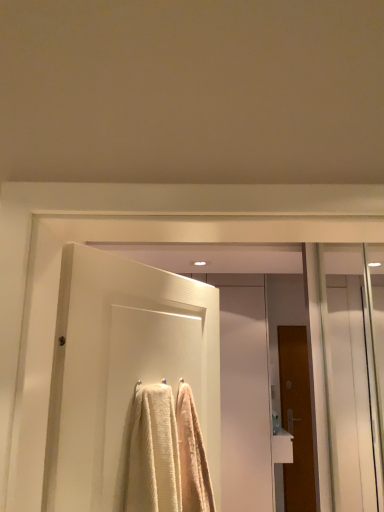
Question: Is brown wooden door at right, which is counted as the 1th door, starting from the bottom, positioned beyond the bounds of white glossy door at center, marked as the second screen door in a front-to-back arrangement?

Choices:
 (A) no
 (B) yes

Answer: (B)

Question: Considering the relative sizes of brown wooden door at right, the second door positioned from the top, and white glossy door at center, marked as the second screen door in a front-to-back arrangement, in the image provided, is brown wooden door at right, the second door positioned from the top, wider than white glossy door at center, marked as the second screen door in a front-to-back arrangement,?

Choices:
 (A) no
 (B) yes

Answer: (B)

Question: Considering the relative sizes of brown wooden door at right, which appears as the second door when viewed from the front, and white glossy door at center, the second screen door in the right-to-left sequence, in the image provided, is brown wooden door at right, which appears as the second door when viewed from the front, taller than white glossy door at center, the second screen door in the right-to-left sequence,?

Choices:
 (A) yes
 (B) no

Answer: (B)

Question: From the image's perspective, is brown wooden door at right, which appears as the second door when viewed from the front, located beneath white glossy door at center, which is the 1th screen door from back to front?

Choices:
 (A) yes
 (B) no

Answer: (A)

Question: Does brown wooden door at right, the second door positioned from the top, contain white glossy door at center, which is the first screen door from left to right?

Choices:
 (A) yes
 (B) no

Answer: (B)

Question: In terms of height, does transparent glass screen door at right, placed as the 1th screen door when sorted from right to left, look taller or shorter compared to white glossy sink at lower right?

Choices:
 (A) tall
 (B) short

Answer: (A)

Question: Relative to white glossy sink at lower right, is transparent glass screen door at right, which is the second screen door from back to front, in front or behind?

Choices:
 (A) front
 (B) behind

Answer: (A)

Question: Looking at the image, does transparent glass screen door at right, which is the second screen door from back to front, seem bigger or smaller compared to white glossy sink at lower right?

Choices:
 (A) big
 (B) small

Answer: (A)

Question: From the image's perspective, is transparent glass screen door at right, marked as the 2th screen door in a left-to-right arrangement, above or below white glossy sink at lower right?

Choices:
 (A) below
 (B) above

Answer: (B)

Question: From the image's perspective, relative to white textured door at center, which is the 1th door in left-to-right order, is brown wooden door at right, which is the 1th door from right to left, above or below?

Choices:
 (A) above
 (B) below

Answer: (B)

Question: Considering the relative positions of brown wooden door at right, which is counted as the 1th door, starting from the bottom, and white textured door at center, the 1th door when ordered from top to bottom, in the image provided, is brown wooden door at right, which is counted as the 1th door, starting from the bottom, to the left or to the right of white textured door at center, the 1th door when ordered from top to bottom,?

Choices:
 (A) right
 (B) left

Answer: (A)

Question: Looking at the image, does brown wooden door at right, which is counted as the 1th door, starting from the bottom, seem bigger or smaller compared to white textured door at center, the first door viewed from the front?

Choices:
 (A) big
 (B) small

Answer: (A)

Question: Considering their positions, is brown wooden door at right, the 1th door when ordered from back to front, located in front of or behind white textured door at center, which is the 1th door in left-to-right order?

Choices:
 (A) front
 (B) behind

Answer: (B)

Question: In terms of size, does white textured door at center, which is the 1th door in left-to-right order, appear bigger or smaller than brown wooden door at right, which appears as the second door when viewed from the front?

Choices:
 (A) small
 (B) big

Answer: (A)

Question: In terms of width, does white textured door at center, which is the 2th door in bottom-to-top order, look wider or thinner when compared to brown wooden door at right, which appears as the 2th door when viewed from the left?

Choices:
 (A) wide
 (B) thin

Answer: (B)